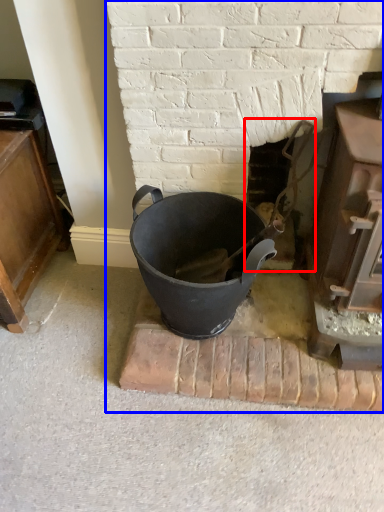
Question: Which of the following is the farthest to the observer, fireplace (highlighted by a red box) or fireplace (highlighted by a blue box)?

Choices:
 (A) fireplace
 (B) fireplace

Answer: (A)